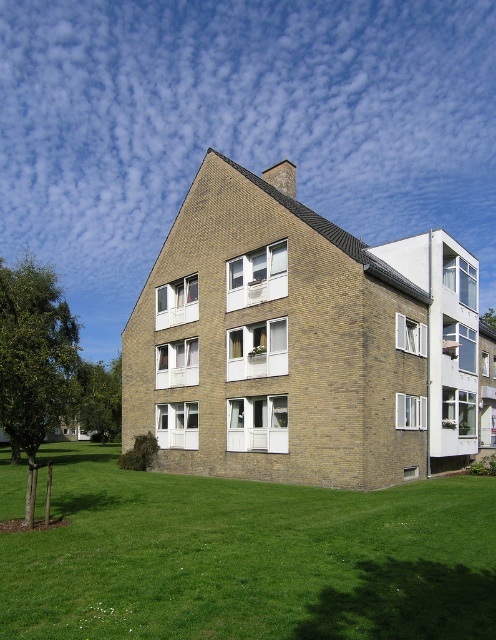
Question: Which object is the closest to the green leafy tree at left?

Choices:
 (A) green grass at lower center
 (B) green leafy tree at lower left

Answer: (A)

Question: In this image, where is green grass at lower center located relative to green leafy tree at lower left?

Choices:
 (A) above
 (B) below

Answer: (A)

Question: Is green grass at lower center smaller than green leafy tree at left?

Choices:
 (A) no
 (B) yes

Answer: (B)

Question: Can you confirm if green grass at lower center is bigger than green leafy tree at left?

Choices:
 (A) yes
 (B) no

Answer: (B)

Question: Based on their relative distances, which object is farther from the green leafy tree at left?

Choices:
 (A) green leafy tree at lower left
 (B) green grass at lower center

Answer: (A)

Question: Which point is closer to the camera?

Choices:
 (A) green leafy tree at left
 (B) green leafy tree at lower left

Answer: (A)